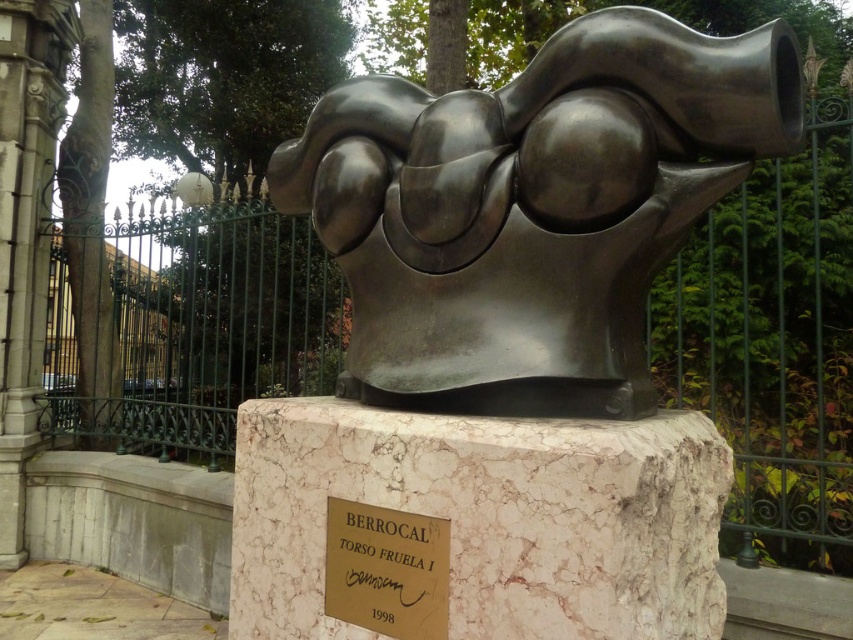
You are an art curator planning to install a new sculpture in a gallery. You have two plaques to display information about the sculpture. The plaques are the gold metallic plaque at center and the white marble plaque at center. Which plaque is shorter in height?

The gold metallic plaque at center is not as tall as the white marble plaque at center, so the gold metallic plaque at center is shorter in height.

You are an art curator standing in front of the sculpture and want to locate the gold metallic plaque at center. Where would you look relative to the sculpture?

The gold metallic plaque at center is located at the coordinates point (386, 570) relative to the sculpture.